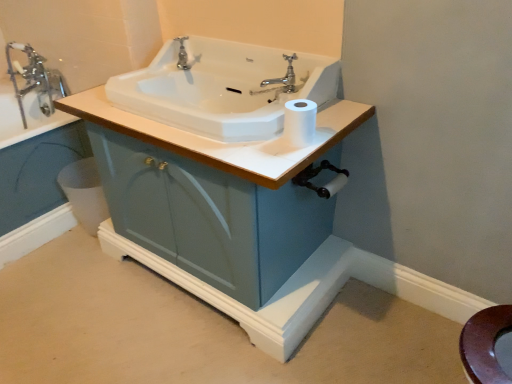
Question: In terms of size, does white glossy bidet at lower left appear bigger or smaller than chrome metallic faucet at upper left, the 2th tap positioned from the right?

Choices:
 (A) small
 (B) big

Answer: (A)

Question: Considering the positions of white glossy bidet at lower left and chrome metallic faucet at upper left, marked as the 2th tap in a front-to-back arrangement, in the image, is white glossy bidet at lower left wider or thinner than chrome metallic faucet at upper left, marked as the 2th tap in a front-to-back arrangement,?

Choices:
 (A) wide
 (B) thin

Answer: (B)

Question: Which is nearer to the polished chrome faucet at upper center, which ranks as the second tap in left-to-right order?

Choices:
 (A) chrome metallic faucet at upper left, marked as the 2th tap in a front-to-back arrangement
 (B) white ceramic sink at center
 (C) white glossy bidet at lower left
 (D) white matte toilet paper at upper center
 (E) matte blue cabinet at center

Answer: (B)

Question: Estimate the real-world distances between objects in this image. Which object is farther from the white matte toilet paper at upper center?

Choices:
 (A) white glossy bidet at lower left
 (B) polished chrome faucet at upper center, acting as the first tap starting from the right
 (C) matte blue cabinet at center
 (D) chrome metallic faucet at upper left, the 2th tap positioned from the right
 (E) white ceramic sink at center

Answer: (D)